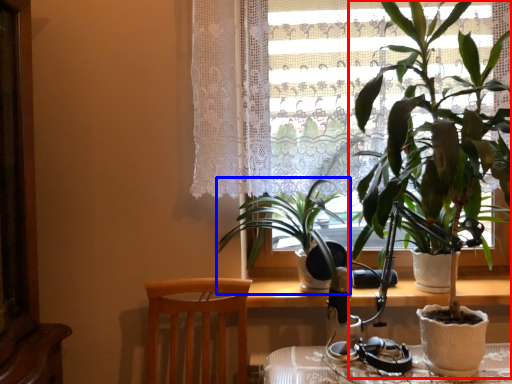
Question: Among these objects, which one is farthest to the camera, houseplant (highlighted by a red box) or houseplant (highlighted by a blue box)?

Choices:
 (A) houseplant
 (B) houseplant

Answer: (B)